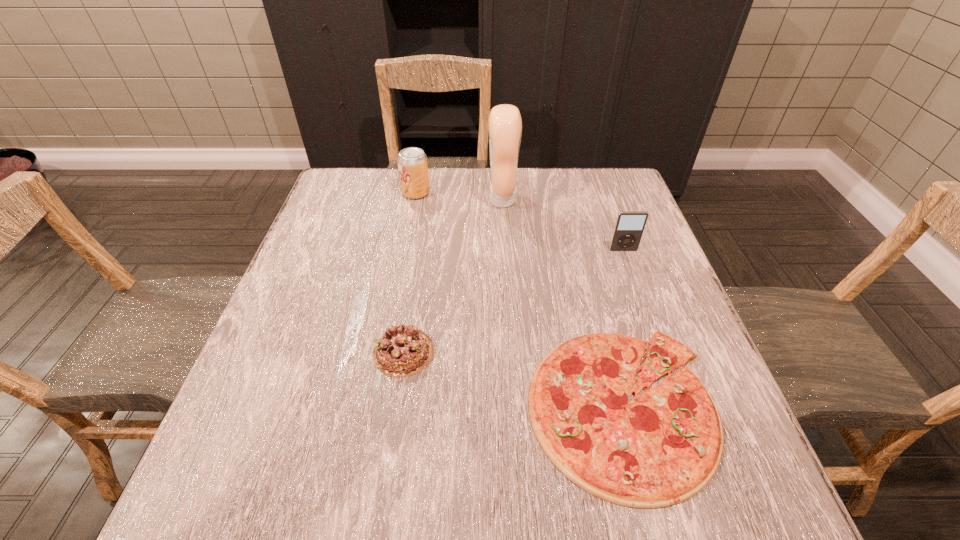
Find the location of a particular element. The height and width of the screenshot is (540, 960). empty space that is in between the pop (soda) and the pizza is located at coordinates pos(519,300).

You are a GUI agent. You are given a task and a screenshot of the screen. Output one action in this format:
    pyautogui.click(x=<x>, y=<y>)
    Task: Click on the vacant region between the pop (soda) and the iPod
    
    Given the screenshot: What is the action you would take?
    pyautogui.click(x=519, y=221)

Locate an element on the screen. The width and height of the screenshot is (960, 540). object that stands as the third closest to the shortest object is located at coordinates (505, 123).

Find the location of a particular element. object that stands as the second closest to the pop (soda) is located at coordinates (403, 350).

Identify the location of free region that satisfies the following two spatial constraints: 1. on the label of the tallest object; 2. on the front side of the second shortest object. (512, 352).

I want to click on vacant space that satisfies the following two spatial constraints: 1. on the front side of the pop (soda); 2. on the left side of the fourth tallest object, so click(x=386, y=352).

You are a GUI agent. You are given a task and a screenshot of the screen. Output one action in this format:
    pyautogui.click(x=<x>, y=<y>)
    Task: Click on the vacant space that satisfies the following two spatial constraints: 1. on the label of the condiment; 2. on the back side of the shortest object
    
    Given the screenshot: What is the action you would take?
    pyautogui.click(x=516, y=407)

Locate an element on the screen. free location that satisfies the following two spatial constraints: 1. on the back side of the pizza; 2. on the label of the tallest object is located at coordinates (569, 200).

Image resolution: width=960 pixels, height=540 pixels. I want to click on free space that satisfies the following two spatial constraints: 1. on the label of the tallest object; 2. on the left side of the shortest object, so click(516, 407).

You are a GUI agent. You are given a task and a screenshot of the screen. Output one action in this format:
    pyautogui.click(x=<x>, y=<y>)
    Task: Click on the vacant space that satisfies the following two spatial constraints: 1. on the front side of the pizza; 2. on the right side of the pop (soda)
    Image resolution: width=960 pixels, height=540 pixels.
    Given the screenshot: What is the action you would take?
    pyautogui.click(x=375, y=407)